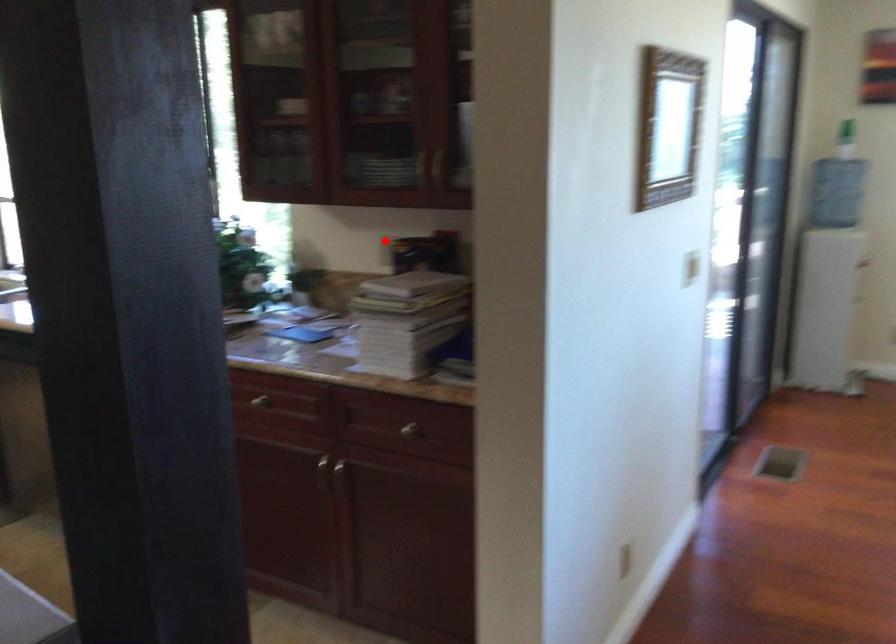
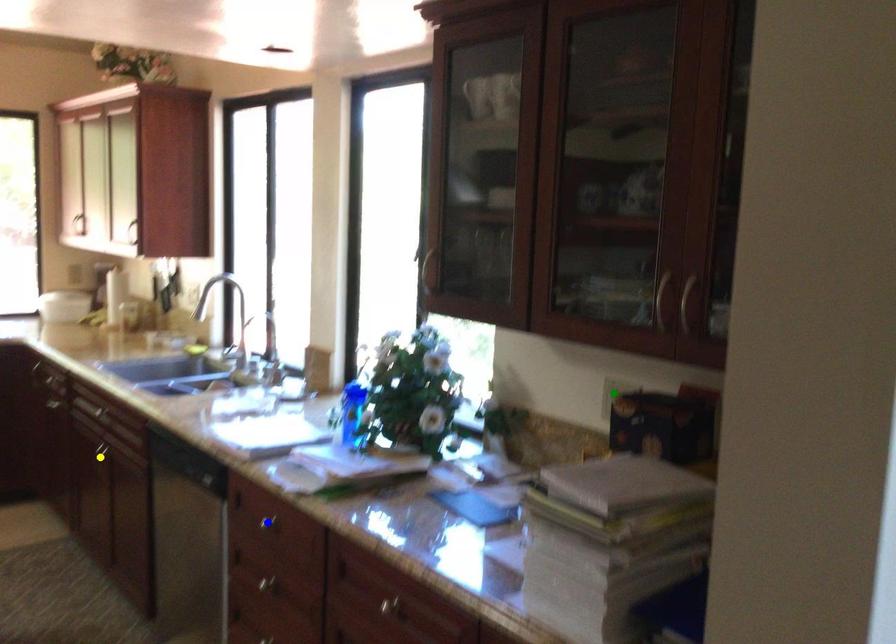
Question: I am providing you with two images of the same scene from different viewpoints. A red point is marked on the first image. You are given multiple points on the second image. Which spot in image 2 lines up with the point in image 1?

Choices:
 (A) yellow point
 (B) blue point
 (C) green point

Answer: (C)